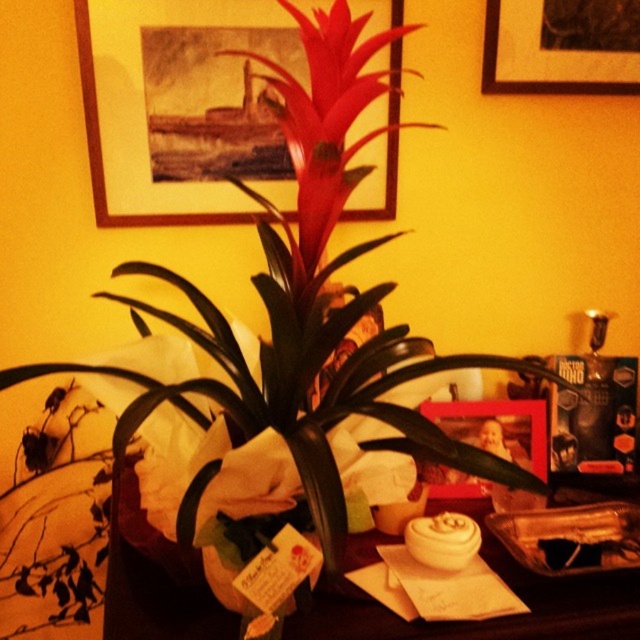
Does wooden framed picture at upper center come in front of matte black table at center?

No, it is behind matte black table at center.

Is wooden framed picture at upper center thinner than matte black table at center?

Yes.

This screenshot has width=640, height=640. What do you see at coordinates (182, 108) in the screenshot?
I see `wooden framed picture at upper center` at bounding box center [182, 108].

Image resolution: width=640 pixels, height=640 pixels. I want to click on wooden framed picture at upper center, so [x=182, y=108].

Based on the photo, which is more to the right, matte black table at center or wooden picture frame at upper center?

Positioned to the right is wooden picture frame at upper center.

Does matte black table at center have a lesser height compared to wooden picture frame at upper center?

No, matte black table at center is not shorter than wooden picture frame at upper center.

What do you see at coordinates (492, 620) in the screenshot? I see `matte black table at center` at bounding box center [492, 620].

Image resolution: width=640 pixels, height=640 pixels. Identify the location of matte black table at center. (492, 620).

What do you see at coordinates (492, 620) in the screenshot? This screenshot has height=640, width=640. I see `matte black table at center` at bounding box center [492, 620].

Does matte black table at center appear over green matte vase at center?

Yes, matte black table at center is above green matte vase at center.

Who is more forward, (211,621) or (209,577)?

Point (211,621) is in front.

The width and height of the screenshot is (640, 640). I want to click on matte black table at center, so click(492, 620).